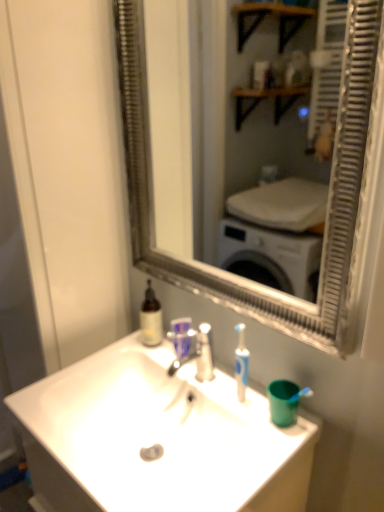
Question: Does silver metallic mirror at center have a lesser width compared to white glossy sink at center?

Choices:
 (A) no
 (B) yes

Answer: (B)

Question: Does silver metallic mirror at center appear on the left side of white glossy sink at center?

Choices:
 (A) yes
 (B) no

Answer: (B)

Question: Does silver metallic mirror at center contain white glossy sink at center?

Choices:
 (A) no
 (B) yes

Answer: (A)

Question: Is silver metallic mirror at center turned away from white glossy sink at center?

Choices:
 (A) no
 (B) yes

Answer: (A)

Question: Is silver metallic mirror at center beside white glossy sink at center?

Choices:
 (A) no
 (B) yes

Answer: (A)

Question: Is white glossy glass door at left situated inside white glossy sink at center or outside?

Choices:
 (A) inside
 (B) outside

Answer: (B)

Question: From a real-world perspective, relative to white glossy sink at center, is white glossy glass door at left vertically above or below?

Choices:
 (A) above
 (B) below

Answer: (A)

Question: Looking at their shapes, would you say white glossy glass door at left is wider or thinner than white glossy sink at center?

Choices:
 (A) thin
 (B) wide

Answer: (A)

Question: In the image, is white glossy glass door at left positioned in front of or behind white glossy sink at center?

Choices:
 (A) behind
 (B) front

Answer: (A)

Question: Is silver metallic faucet at center taller or shorter than white glossy glass door at left?

Choices:
 (A) short
 (B) tall

Answer: (A)

Question: Based on their sizes in the image, would you say silver metallic faucet at center is bigger or smaller than white glossy glass door at left?

Choices:
 (A) small
 (B) big

Answer: (A)

Question: Considering the relative positions of silver metallic faucet at center and white glossy glass door at left in the image provided, is silver metallic faucet at center to the left or to the right of white glossy glass door at left?

Choices:
 (A) left
 (B) right

Answer: (B)

Question: In terms of width, does silver metallic faucet at center look wider or thinner when compared to white glossy glass door at left?

Choices:
 (A) thin
 (B) wide

Answer: (A)

Question: In terms of height, does silver metallic mirror at center look taller or shorter compared to translucent glass bottle at upper left?

Choices:
 (A) tall
 (B) short

Answer: (A)

Question: Is silver metallic mirror at center in front of or behind translucent glass bottle at upper left in the image?

Choices:
 (A) behind
 (B) front

Answer: (B)